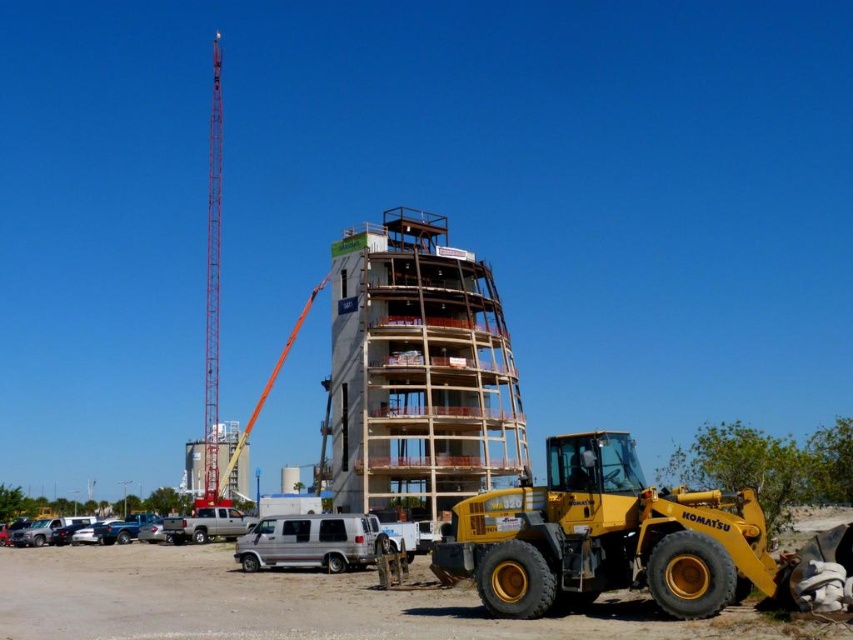
From the picture: Can you confirm if wooden scaffolding at center is positioned below silver metallic van at center?

No.

The image size is (853, 640). Describe the element at coordinates (416, 372) in the screenshot. I see `wooden scaffolding at center` at that location.

Between point (343, 332) and point (286, 536), which one is positioned behind?

The point (343, 332) is behind.

Locate an element on the screen. The height and width of the screenshot is (640, 853). wooden scaffolding at center is located at coordinates click(416, 372).

Is point (252, 554) more distant than point (207, 394)?

That is False.

Describe the element at coordinates (310, 541) in the screenshot. I see `silver metallic van at center` at that location.

Identify the location of silver metallic van at center. This screenshot has height=640, width=853. (310, 541).

Who is higher up, wooden scaffolding at center or red metallic tower crane at left?

red metallic tower crane at left

Between wooden scaffolding at center and red metallic tower crane at left, which one has less height?

With less height is wooden scaffolding at center.

This screenshot has height=640, width=853. I want to click on wooden scaffolding at center, so click(416, 372).

Identify the location of wooden scaffolding at center. [416, 372].